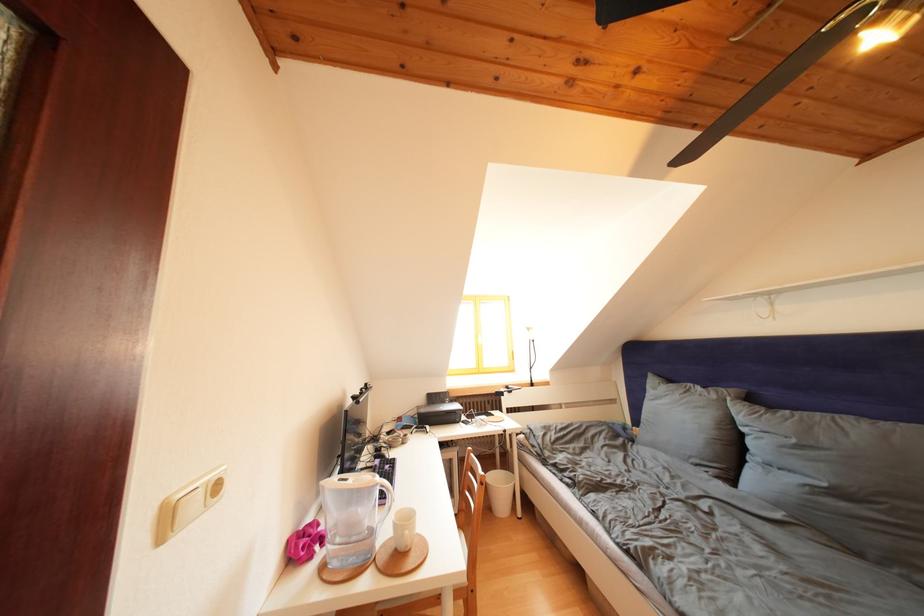
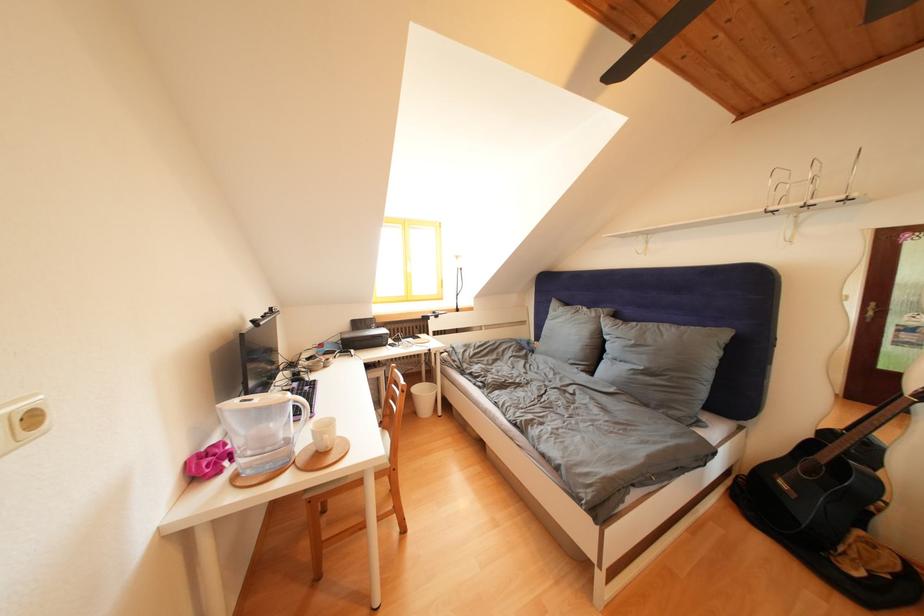
The images are taken continuously from a first-person perspective. In which direction is your viewpoint rotating?

The camera's rotation is toward right-down.